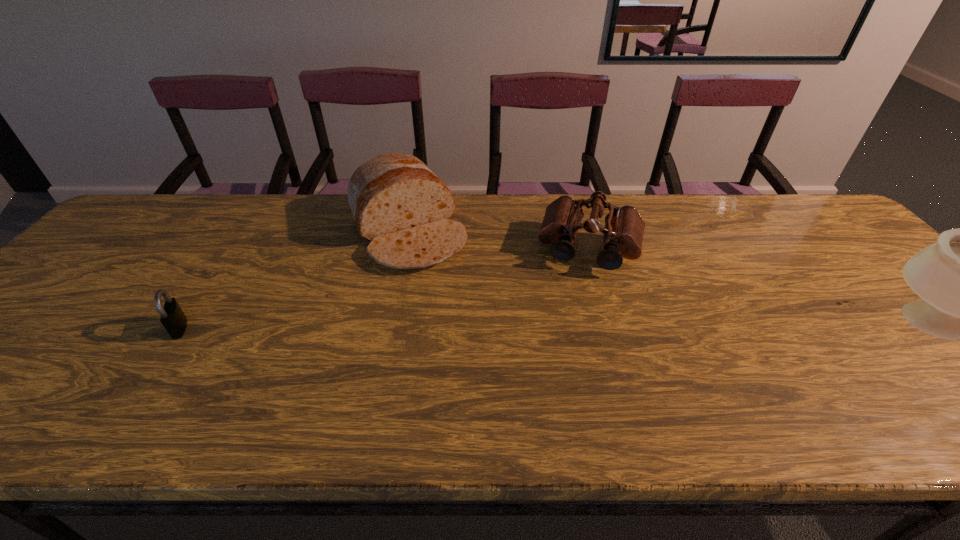
Identify the location of the leftmost object. The height and width of the screenshot is (540, 960). (172, 317).

Identify the location of the shortest object. This screenshot has width=960, height=540. (172, 317).

At what (x,y) coordinates should I click in order to perform the action: click on the third tallest object. Please return your answer as a coordinate pair (x, y). Looking at the image, I should click on (624, 227).

Locate an element on the screen. The height and width of the screenshot is (540, 960). the third object from left to right is located at coordinates (624, 227).

This screenshot has height=540, width=960. Identify the location of the third object from right to left. (399, 205).

The image size is (960, 540). What are the coordinates of `the third shortest object` in the screenshot? It's located at (399, 205).

This screenshot has height=540, width=960. Find the location of `vacant space located 0.060m on the left of the padlock`. vacant space located 0.060m on the left of the padlock is located at coordinates (146, 328).

You are a GUI agent. You are given a task and a screenshot of the screen. Output one action in this format:
    pyautogui.click(x=<x>, y=<y>)
    Task: Click on the free space located 0.330m through the eyepieces of the third object from left to right
    The width and height of the screenshot is (960, 540).
    Given the screenshot: What is the action you would take?
    pyautogui.click(x=559, y=379)

The image size is (960, 540). I want to click on free space located through the eyepieces of the third object from left to right, so 566,343.

Locate an element on the screen. free location located 0.100m through the eyepieces of the third object from left to right is located at coordinates (575, 303).